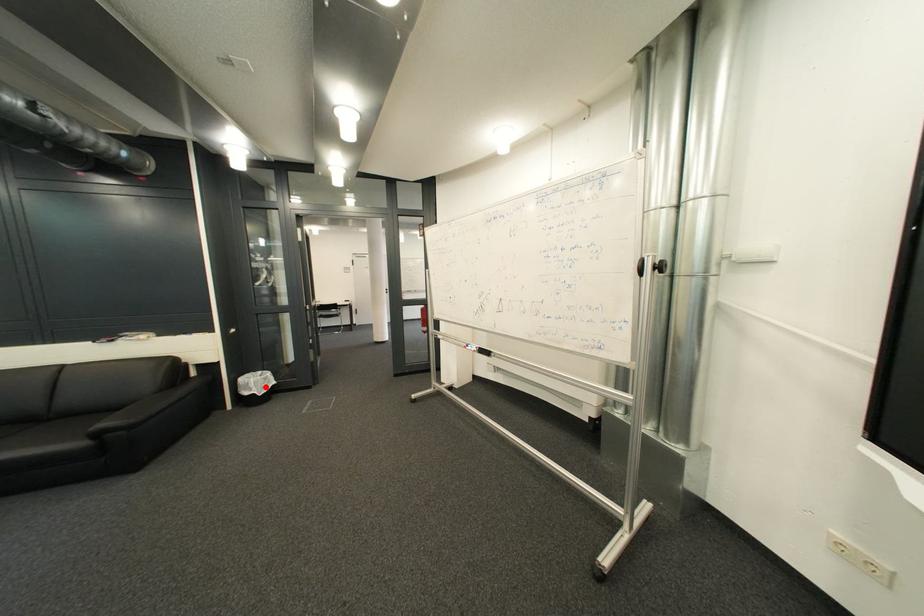
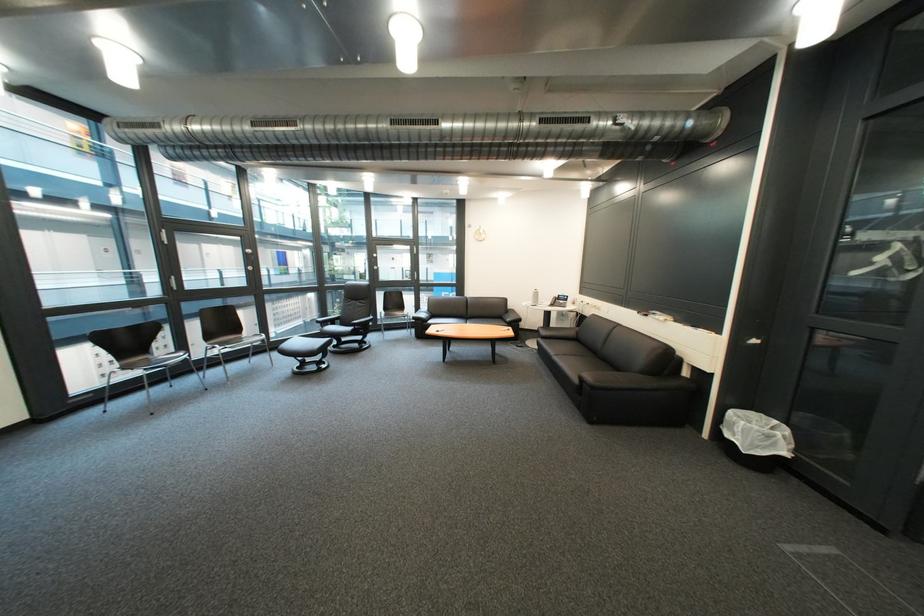
Question: I am providing you with two images of the same scene from different viewpoints. A red point is marked on the first image. Is the red point's position out of view in image 2?

Choices:
 (A) Yes
 (B) No

Answer: (B)